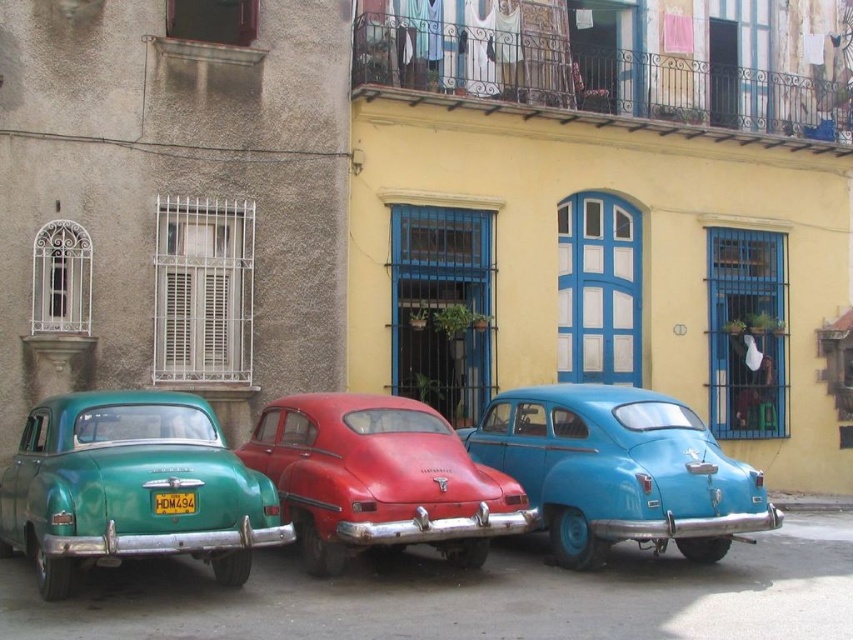
Question: Is matte blue car at center positioned behind rusty red car at center?

Choices:
 (A) no
 (B) yes

Answer: (B)

Question: Is teal glossy sedan at left smaller than rusty red car at center?

Choices:
 (A) yes
 (B) no

Answer: (A)

Question: Which point is closer to the camera taking this photo?

Choices:
 (A) (643, 536)
 (B) (184, 509)
 (C) (30, 476)
 (D) (317, 477)

Answer: (B)

Question: Is matte blue car at center to the right of rusty red car at center from the viewer's perspective?

Choices:
 (A) no
 (B) yes

Answer: (B)

Question: Which point is farther from the camera taking this photo?

Choices:
 (A) (172, 499)
 (B) (311, 508)
 (C) (598, 497)
 (D) (70, 470)

Answer: (C)

Question: Considering the real-world distances, which object is farthest from the yellow matte license plate at center?

Choices:
 (A) rusty red car at center
 (B) matte blue car at center

Answer: (B)